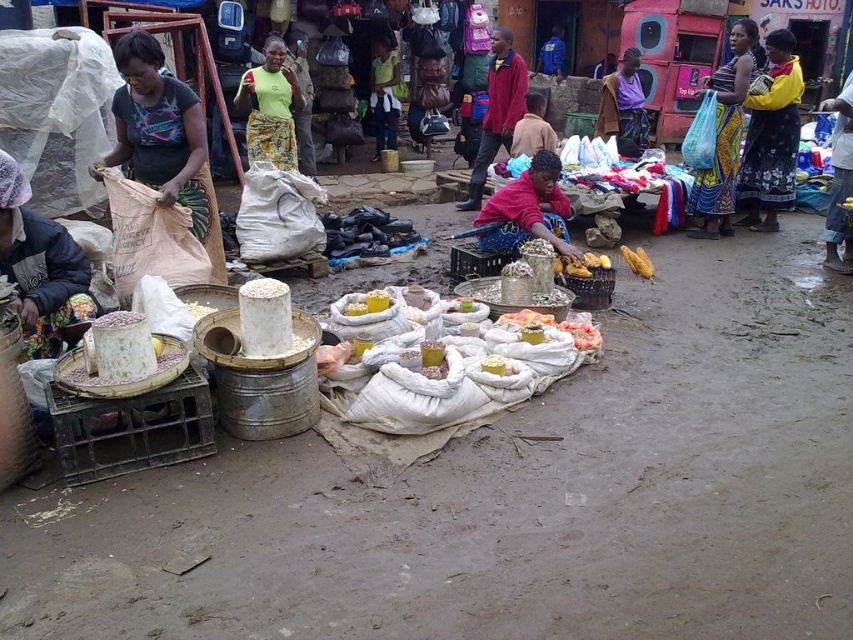
Question: Which object appears closest to the camera in this image?

Choices:
 (A) pink fabric at center
 (B) yellow smooth corn at center
 (C) yellow corn at center
 (D) printed fabric dress at right

Answer: (B)

Question: Does yellow fabric skirt at right have a greater width compared to yellow smooth corn at center?

Choices:
 (A) yes
 (B) no

Answer: (A)

Question: Can you confirm if yellow smooth corn at center is wider than white matte corn at center?

Choices:
 (A) yes
 (B) no

Answer: (A)

Question: Which of these objects is positioned farthest from the printed fabric dress at right?

Choices:
 (A) yellow corn at center
 (B) yellow fabric skirt at right

Answer: (A)

Question: Is brown paper bag at left thinner than yellow smooth corn at center?

Choices:
 (A) yes
 (B) no

Answer: (B)

Question: Which point appears closest to the camera in this image?

Choices:
 (A) (566, 218)
 (B) (595, 262)
 (C) (288, 83)

Answer: (B)